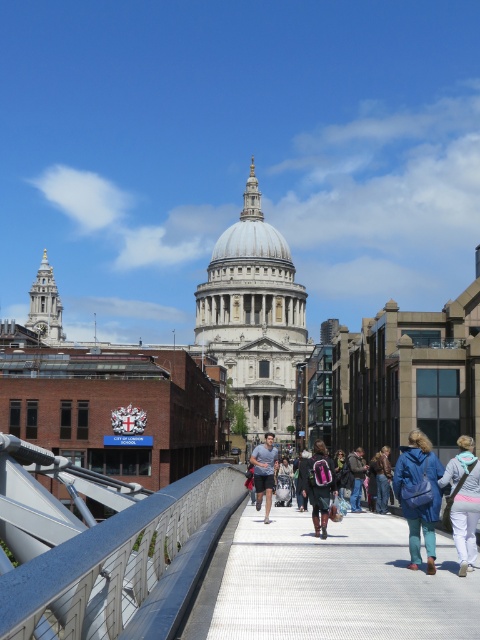
You are standing at the base of St. Paul Cathedral and want to take a photo of the metallic gray bridge at center and the blue fabric backpack at lower right. Which object should you focus on first to ensure both are in the frame?

You should focus on the metallic gray bridge at center first because it is closer to the viewer than the blue fabric backpack at lower right, so adjusting the camera to include it will also capture the backpack in the background.

You are standing on the pedestrian bridge in the image and want to place a 36 inches long object between the blue denim jeans at center and the blue fabric backpack at lower right. Will it fit?

The distance between the blue denim jeans at center and the blue fabric backpack at lower right is 36.14 inches, so the 36 inches long object will fit between them.

You are a photographer standing on the pedestrian bridge in the scene. You notice two blue items in your viewfinder. The first is a pair of blue denim jeans at center, and the second is a blue fabric backpack at lower right. Which of these two items is positioned lower in the frame?

The blue denim jeans at center is positioned lower in the frame than the blue fabric backpack at lower right.